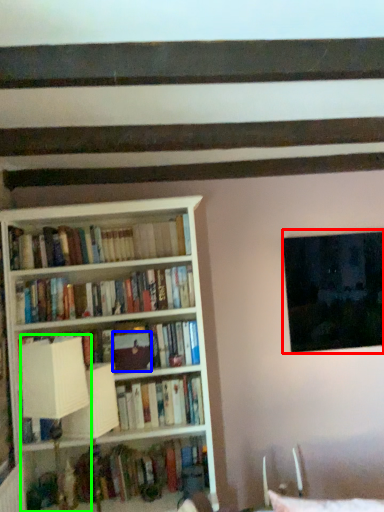
Question: Estimate the real-world distances between objects in this image. Which object is farther from window (highlighted by a red box), paperback book (highlighted by a blue box) or table lamp (highlighted by a green box)?

Choices:
 (A) paperback book
 (B) table lamp

Answer: (B)